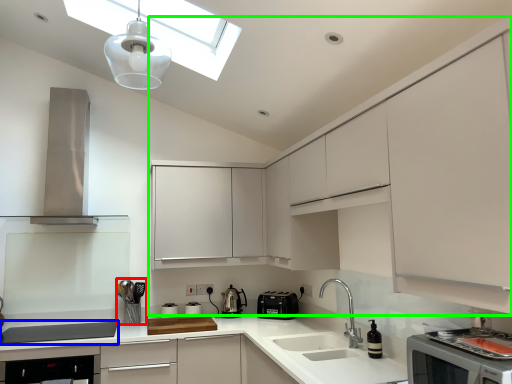
Question: Which object is the closest to the appliance (highlighted by a red box)? Choose among these: home appliance (highlighted by a blue box) or cabinetry (highlighted by a green box).

Choices:
 (A) home appliance
 (B) cabinetry

Answer: (A)